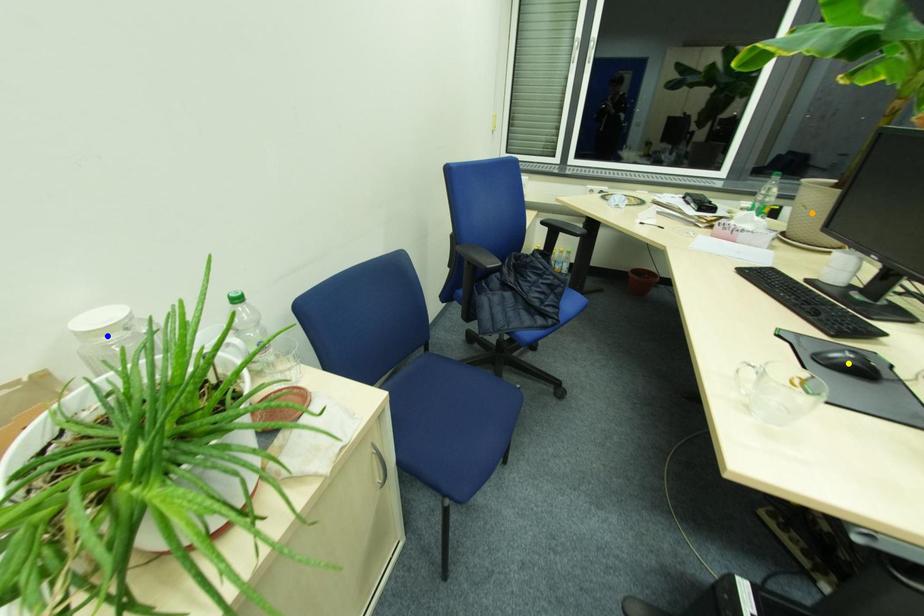
Consider the image. Order these from nearest to farthest:
blue point, yellow point, orange point

orange point → yellow point → blue point